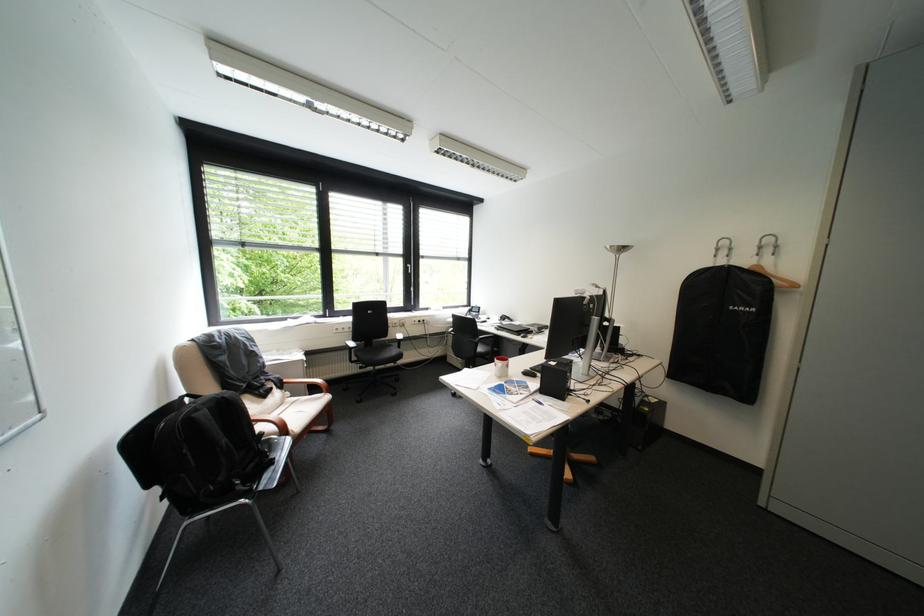
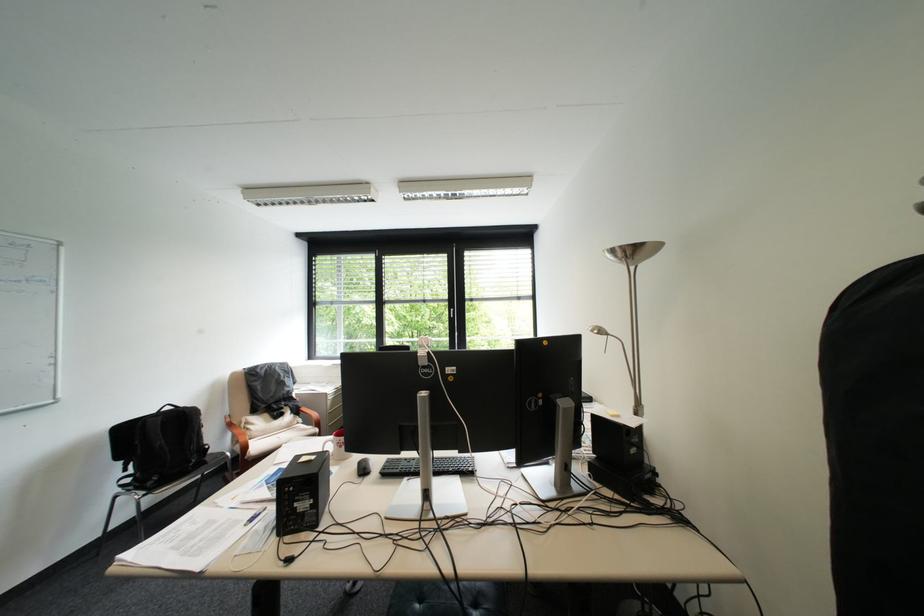
Where in the second image is the point corresponding to pixel 623 246 from the first image?

(625, 252)